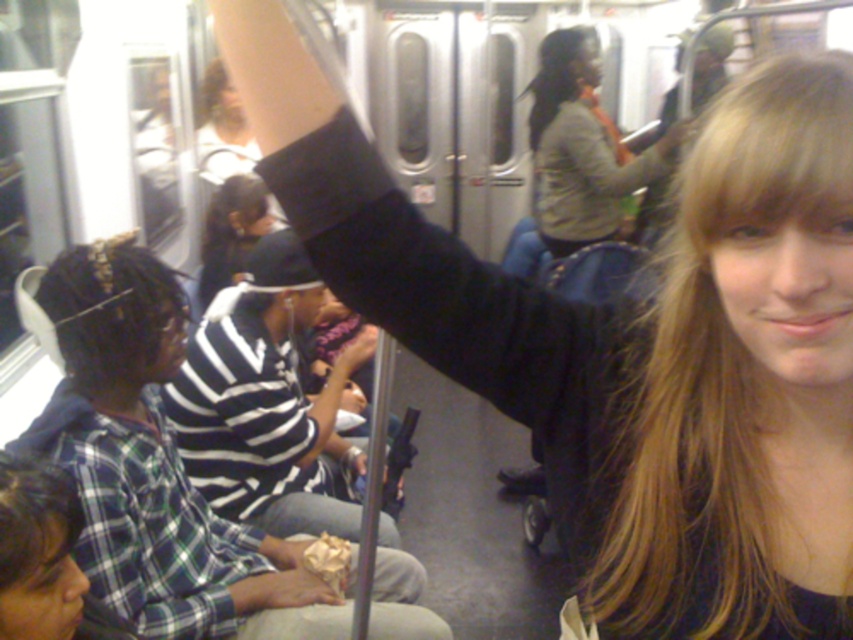
Question: Among these points, which one is nearest to the camera?

Choices:
 (A) (320, 291)
 (B) (225, 624)

Answer: (B)

Question: Is plaid shirt at lower left thinner than black striped shirt at center?

Choices:
 (A) yes
 (B) no

Answer: (B)

Question: Which of the following is the closest to the observer?

Choices:
 (A) beige fabric jacket at center
 (B) plaid shirt at lower left
 (C) black striped shirt at center

Answer: (B)

Question: Which point appears closest to the camera in this image?

Choices:
 (A) (541, 112)
 (B) (144, 604)

Answer: (B)

Question: Can you confirm if black striped shirt at center is positioned below beige fabric jacket at center?

Choices:
 (A) no
 (B) yes

Answer: (B)

Question: Can you confirm if plaid shirt at lower left is positioned above black striped shirt at center?

Choices:
 (A) yes
 (B) no

Answer: (B)